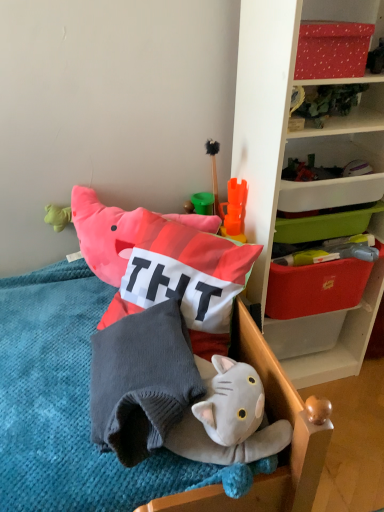
Locate an element on the screen. The height and width of the screenshot is (512, 384). red dotted fabric at upper right, positioned as the first storage box in top-to-bottom order is located at coordinates (332, 49).

Image resolution: width=384 pixels, height=512 pixels. Describe the element at coordinates (293, 132) in the screenshot. I see `white plastic shelf at upper right` at that location.

At what (x,y) coordinates should I click in order to perform the action: click on orange plastic storage box at upper right, acting as the second storage box starting from the bottom. Please return your answer as a coordinate pair (x, y). Image resolution: width=384 pixels, height=512 pixels. Looking at the image, I should click on (336, 178).

Describe the element at coordinates (315, 288) in the screenshot. I see `red plastic storage box at upper right, which is counted as the 3th storage box, starting from the top` at that location.

Where is `soft cotton pillow at center`? The height and width of the screenshot is (512, 384). soft cotton pillow at center is located at coordinates (163, 266).

Where is `wooden chair at lower center`? wooden chair at lower center is located at coordinates point(70,406).

This screenshot has height=512, width=384. What are the coordinates of `red dotted fabric at upper right, which is the 3th storage box from bottom to top` in the screenshot? It's located at (332, 49).

Is white plastic shelf at upper right bigger than red dotted fabric at upper right, which is the 3th storage box from bottom to top?

Indeed, white plastic shelf at upper right has a larger size compared to red dotted fabric at upper right, which is the 3th storage box from bottom to top.

Considering the relative sizes of white plastic shelf at upper right and red dotted fabric at upper right, which is the 3th storage box from bottom to top, in the image provided, is white plastic shelf at upper right thinner than red dotted fabric at upper right, which is the 3th storage box from bottom to top,?

Incorrect, the width of white plastic shelf at upper right is not less than that of red dotted fabric at upper right, which is the 3th storage box from bottom to top.

Is there a large distance between white plastic shelf at upper right and red dotted fabric at upper right, which is the 3th storage box from bottom to top?

They are positioned close to each other.

Is red dotted fabric at upper right, which is the 3th storage box from bottom to top, at the back of white plastic shelf at upper right?

No.

Does soft cotton pillow at center turn towards orange plastic storage box at upper right, acting as the second storage box starting from the bottom?

No, soft cotton pillow at center is not oriented towards orange plastic storage box at upper right, acting as the second storage box starting from the bottom.

Considering the relative positions of soft cotton pillow at center and orange plastic storage box at upper right, acting as the second storage box starting from the bottom, in the image provided, is soft cotton pillow at center behind orange plastic storage box at upper right, acting as the second storage box starting from the bottom,?

No, it is in front of orange plastic storage box at upper right, acting as the second storage box starting from the bottom.

From a real-world perspective, is soft cotton pillow at center below orange plastic storage box at upper right, acting as the second storage box starting from the bottom?

Correct, in the physical world, soft cotton pillow at center is lower than orange plastic storage box at upper right, acting as the second storage box starting from the bottom.

From their relative heights in the image, would you say soft cotton pillow at center is taller or shorter than orange plastic storage box at upper right, which is the second storage box from top to bottom?

Clearly, soft cotton pillow at center is taller compared to orange plastic storage box at upper right, which is the second storage box from top to bottom.

From a real-world perspective, is red plastic storage box at upper right, which appears as the first storage box when ordered from the bottom, located higher than wooden chair at lower center?

Yes, from a real-world perspective, red plastic storage box at upper right, which appears as the first storage box when ordered from the bottom, is above wooden chair at lower center.

Is point (345, 277) in front of point (8, 382)?

No.

Are red plastic storage box at upper right, which is counted as the 3th storage box, starting from the top, and wooden chair at lower center beside each other?

No, red plastic storage box at upper right, which is counted as the 3th storage box, starting from the top, is not next to wooden chair at lower center.

From the image's perspective, does red plastic storage box at upper right, which is counted as the 3th storage box, starting from the top, appear higher than wooden chair at lower center?

Answer: Indeed, from the image's perspective, red plastic storage box at upper right, which is counted as the 3th storage box, starting from the top, is shown above wooden chair at lower center.

Between orange plastic storage box at upper right, acting as the second storage box starting from the bottom, and red plastic storage box at upper right, which is counted as the 3th storage box, starting from the top, which one has larger size?

Bigger between the two is orange plastic storage box at upper right, acting as the second storage box starting from the bottom.

Consider the image. Is red plastic storage box at upper right, which is counted as the 3th storage box, starting from the top, completely or partially inside orange plastic storage box at upper right, acting as the second storage box starting from the bottom?

No.

From the picture: Is orange plastic storage box at upper right, which is the second storage box from top to bottom, aimed at red plastic storage box at upper right, which is counted as the 3th storage box, starting from the top?

No, orange plastic storage box at upper right, which is the second storage box from top to bottom, is not turned towards red plastic storage box at upper right, which is counted as the 3th storage box, starting from the top.

Consider the image. Considering the positions of objects orange plastic storage box at upper right, acting as the second storage box starting from the bottom, and red plastic storage box at upper right, which appears as the first storage box when ordered from the bottom, in the image provided, who is more to the right, orange plastic storage box at upper right, acting as the second storage box starting from the bottom, or red plastic storage box at upper right, which appears as the first storage box when ordered from the bottom,?

red plastic storage box at upper right, which appears as the first storage box when ordered from the bottom, is more to the right.

Is red plastic storage box at upper right, which is counted as the 3th storage box, starting from the top, located outside orange plastic storage box at upper right, which is the second storage box from top to bottom?

Yes, red plastic storage box at upper right, which is counted as the 3th storage box, starting from the top, is outside of orange plastic storage box at upper right, which is the second storage box from top to bottom.

Can you confirm if red plastic storage box at upper right, which appears as the first storage box when ordered from the bottom, is wider than orange plastic storage box at upper right, which is the second storage box from top to bottom?

No.

Which is behind, point (327, 301) or point (382, 156)?

Point (327, 301)

Consider the image. From a real-world perspective, does red dotted fabric at upper right, which is the 3th storage box from bottom to top, sit lower than white plastic shelf at upper right?

Incorrect, from a real-world perspective, red dotted fabric at upper right, which is the 3th storage box from bottom to top, is higher than white plastic shelf at upper right.

In terms of width, does red dotted fabric at upper right, positioned as the first storage box in top-to-bottom order, look wider or thinner when compared to white plastic shelf at upper right?

In the image, red dotted fabric at upper right, positioned as the first storage box in top-to-bottom order, appears to be more narrow than white plastic shelf at upper right.

Do you think red dotted fabric at upper right, which is the 3th storage box from bottom to top, is within white plastic shelf at upper right, or outside of it?

red dotted fabric at upper right, which is the 3th storage box from bottom to top, exists entirely within white plastic shelf at upper right.

In the scene shown: Can you confirm if red dotted fabric at upper right, positioned as the first storage box in top-to-bottom order, is bigger than white plastic shelf at upper right?

No.

There is a soft cotton pillow at center. Identify the location of the 1st storage box above it (from the image's perspective). (315, 288).

Can you confirm if red plastic storage box at upper right, which is counted as the 3th storage box, starting from the top, is positioned to the left of soft cotton pillow at center?

No, red plastic storage box at upper right, which is counted as the 3th storage box, starting from the top, is not to the left of soft cotton pillow at center.

From the image's perspective, which one is positioned lower, red plastic storage box at upper right, which appears as the first storage box when ordered from the bottom, or soft cotton pillow at center?

From the image's view, soft cotton pillow at center is below.

Considering the sizes of red plastic storage box at upper right, which is counted as the 3th storage box, starting from the top, and soft cotton pillow at center in the image, is red plastic storage box at upper right, which is counted as the 3th storage box, starting from the top, taller or shorter than soft cotton pillow at center?

Considering their sizes, red plastic storage box at upper right, which is counted as the 3th storage box, starting from the top, has less height than soft cotton pillow at center.

You are a GUI agent. You are given a task and a screenshot of the screen. Output one action in this format:
    pyautogui.click(x=<x>, y=<y>)
    Task: Click on the 2nd storage box to the left of the white plastic shelf at upper right, counting from the anchor's position
    
    Given the screenshot: What is the action you would take?
    pyautogui.click(x=332, y=49)

Image resolution: width=384 pixels, height=512 pixels. Identify the location of the 1st storage box above the soft cotton pillow at center (from a real-world perspective). (336, 178).

Which object lies nearer to the anchor point orange plastic storage box at upper right, acting as the second storage box starting from the bottom, gray knitted pillow at center or red plastic storage box at upper right, which is counted as the 3th storage box, starting from the top?

Based on the image, red plastic storage box at upper right, which is counted as the 3th storage box, starting from the top, appears to be nearer to orange plastic storage box at upper right, acting as the second storage box starting from the bottom.

Considering their positions, is white plastic shelf at upper right positioned closer to red dotted fabric at upper right, which is the 3th storage box from bottom to top, than red plastic storage box at upper right, which appears as the first storage box when ordered from the bottom?

The object closer to red dotted fabric at upper right, which is the 3th storage box from bottom to top, is white plastic shelf at upper right.

Which object lies further to the anchor point gray knitted pillow at center, white plastic shelf at upper right or red dotted fabric at upper right, which is the 3th storage box from bottom to top?

red dotted fabric at upper right, which is the 3th storage box from bottom to top, lies further to gray knitted pillow at center than the other object.

In the scene shown: From the image, which object appears to be farther from wooden chair at lower center, soft cotton pillow at center or white plastic shelf at upper right?

The object further to wooden chair at lower center is white plastic shelf at upper right.

Looking at this image, from the image, which object appears to be farther from soft cotton pillow at center, white plastic shelf at upper right or wooden chair at lower center?

white plastic shelf at upper right is further to soft cotton pillow at center.

When comparing their distances from red plastic storage box at upper right, which appears as the first storage box when ordered from the bottom, does white plastic shelf at upper right or gray knitted pillow at center seem further?

Based on the image, gray knitted pillow at center appears to be further to red plastic storage box at upper right, which appears as the first storage box when ordered from the bottom.

Which object lies further to the anchor point orange plastic storage box at upper right, acting as the second storage box starting from the bottom, wooden chair at lower center or white plastic shelf at upper right?

wooden chair at lower center is positioned further to the anchor orange plastic storage box at upper right, acting as the second storage box starting from the bottom.

Which object lies further to the anchor point white plastic shelf at upper right, red plastic storage box at upper right, which appears as the first storage box when ordered from the bottom, or soft cotton pillow at center?

The object further to white plastic shelf at upper right is soft cotton pillow at center.

At what (x,y) coordinates should I click in order to perform the action: click on shelf between wooden chair at lower center and red plastic storage box at upper right, which is counted as the 3th storage box, starting from the top. Please return your answer as a coordinate pair (x, y). The image size is (384, 512). Looking at the image, I should click on (293, 132).

Identify the location of pillow between wooden chair at lower center and red plastic storage box at upper right, which appears as the first storage box when ordered from the bottom, in the front-back direction. The height and width of the screenshot is (512, 384). (141, 381).

The height and width of the screenshot is (512, 384). What are the coordinates of `toy located between wooden chair at lower center and white plastic shelf at upper right in the left-right direction` in the screenshot? It's located at (163, 266).

The image size is (384, 512). Identify the location of toy located between gray knitted pillow at center and white plastic shelf at upper right in the left-right direction. (163, 266).